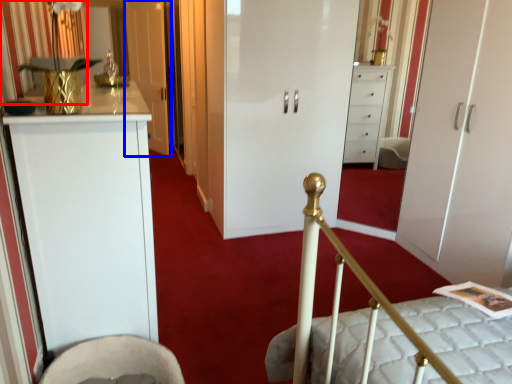
Question: Which of the following is the farthest to the observer, curtain (highlighted by a red box) or door (highlighted by a blue box)?

Choices:
 (A) curtain
 (B) door

Answer: (B)